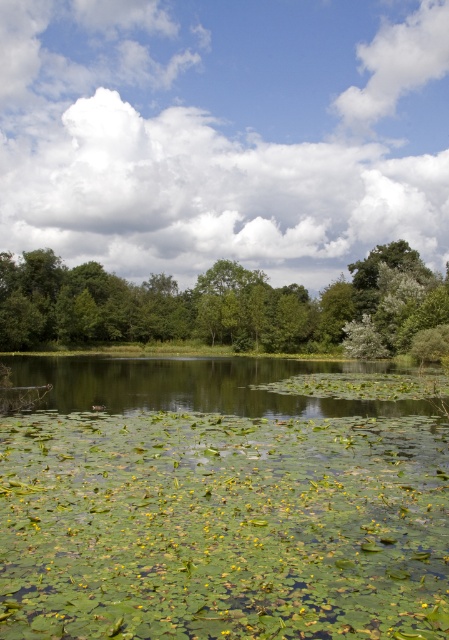
Question: Which of the following is the farthest from the observer?

Choices:
 (A) (155, 301)
 (B) (399, 490)

Answer: (A)

Question: Which point is farther from the camera taking this photo?

Choices:
 (A) (238, 406)
 (B) (166, 300)

Answer: (B)

Question: Is green leafy water at center further to the viewer compared to green leafy tree at center?

Choices:
 (A) yes
 (B) no

Answer: (B)

Question: Which point is closer to the camera?

Choices:
 (A) (374, 486)
 (B) (73, 316)

Answer: (A)

Question: Is green leafy water at center further to the viewer compared to green leafy tree at center?

Choices:
 (A) yes
 (B) no

Answer: (B)

Question: Can you confirm if green leafy water at center is positioned to the left of green leafy tree at center?

Choices:
 (A) yes
 (B) no

Answer: (B)